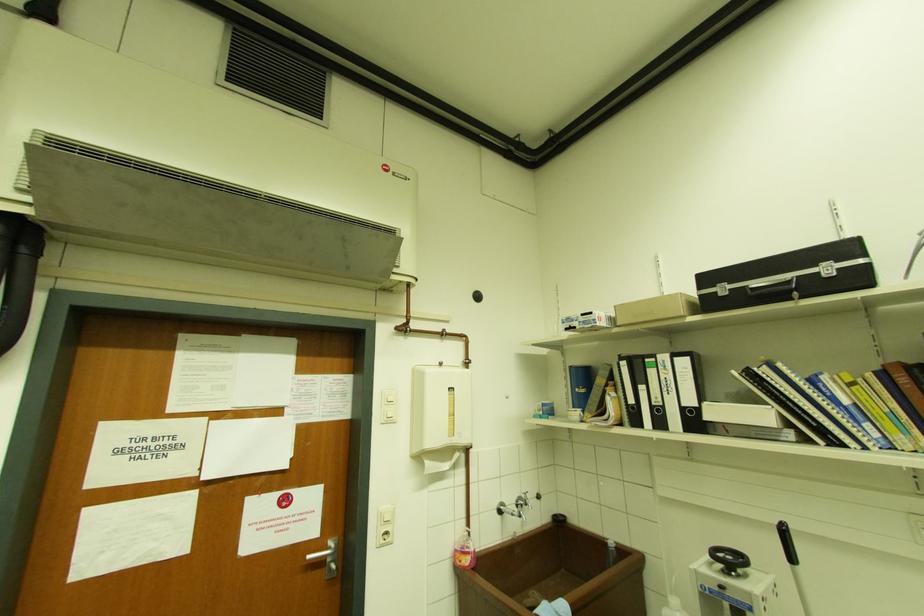
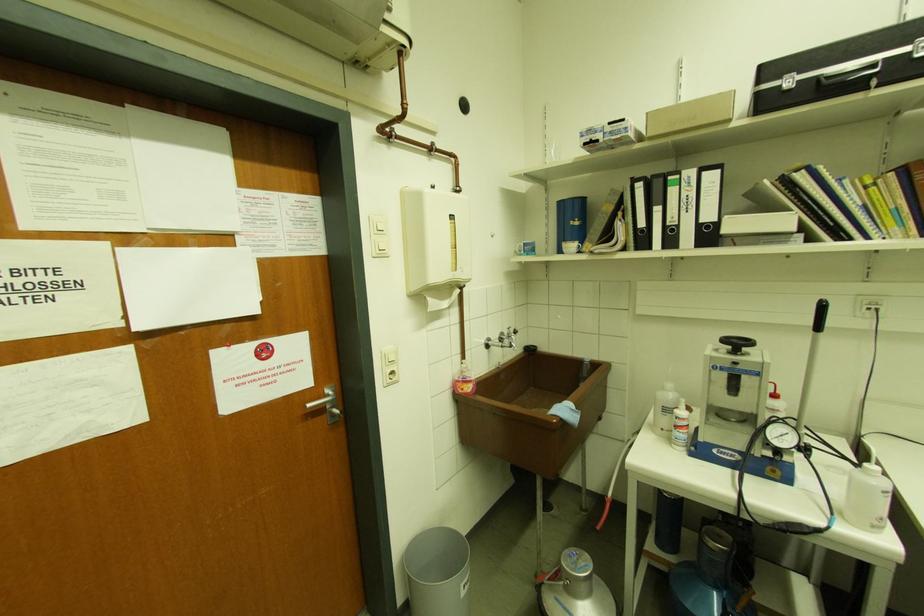
What movement of the cameraman would produce the second image?

The cameraman walked toward left, forward.